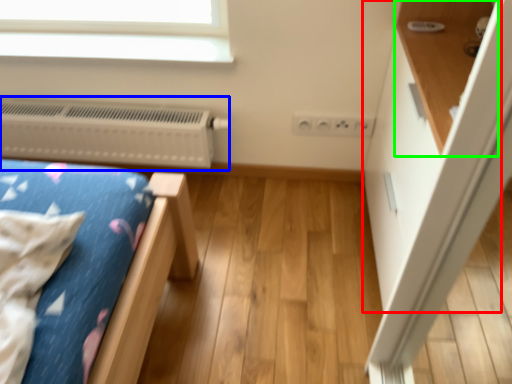
Question: Which object is positioned farthest from dresser (highlighted by a red box)? Select from heater (highlighted by a blue box) and shelf (highlighted by a green box).

Choices:
 (A) heater
 (B) shelf

Answer: (A)